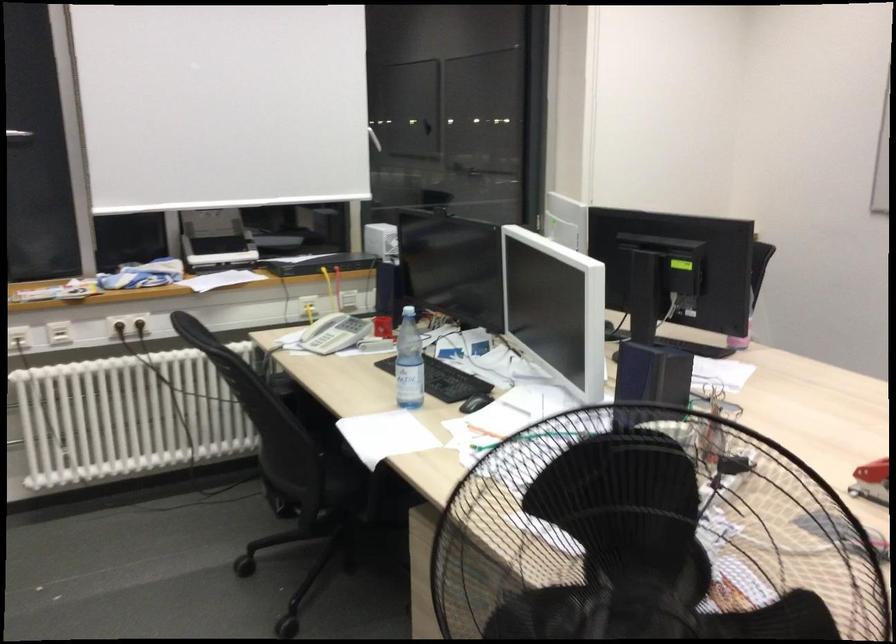
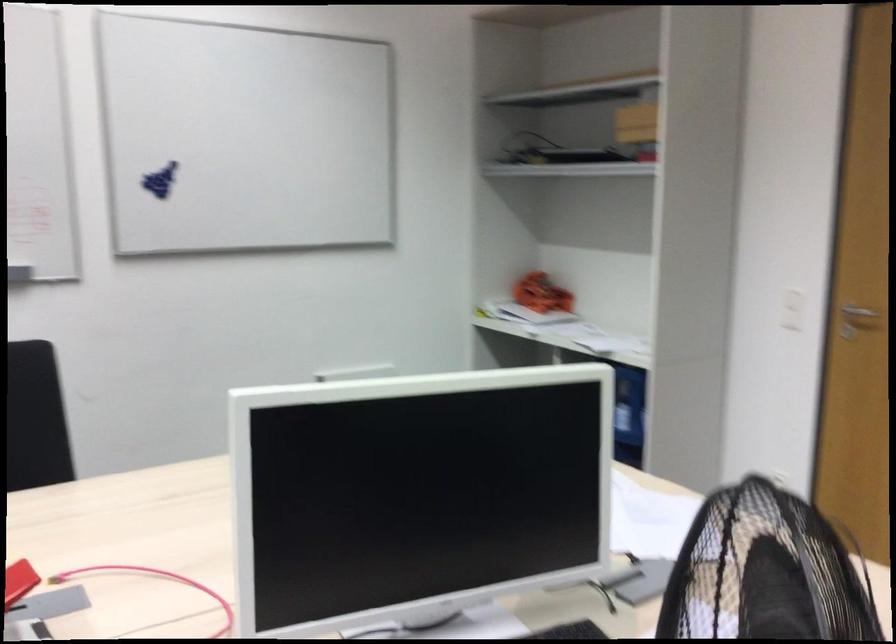
Question: The images are taken continuously from a first-person perspective. In which direction is your viewpoint rotating?

Choices:
 (A) Left
 (B) Right
 (C) Up
 (D) Down

Answer: (B)